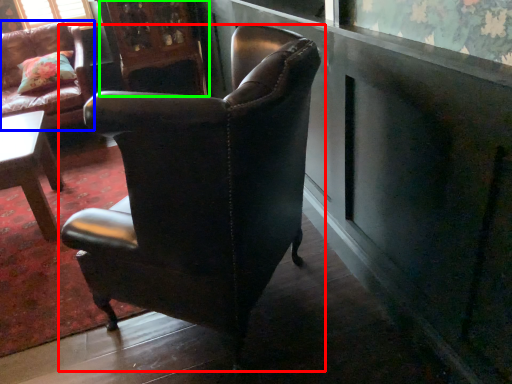
Question: Which is nearer to the chair (highlighted by a red box)? chair (highlighted by a blue box) or armoire (highlighted by a green box).

Choices:
 (A) chair
 (B) armoire

Answer: (A)